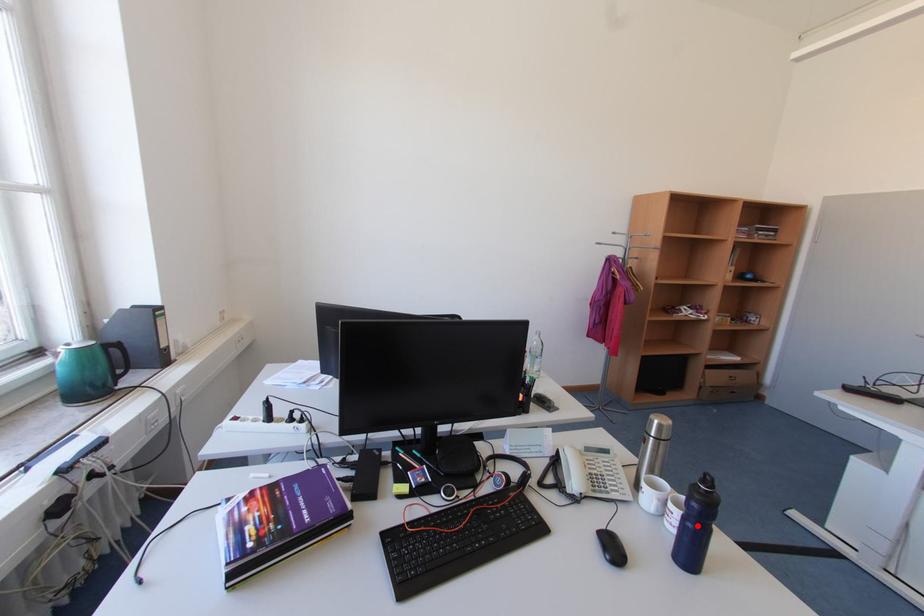
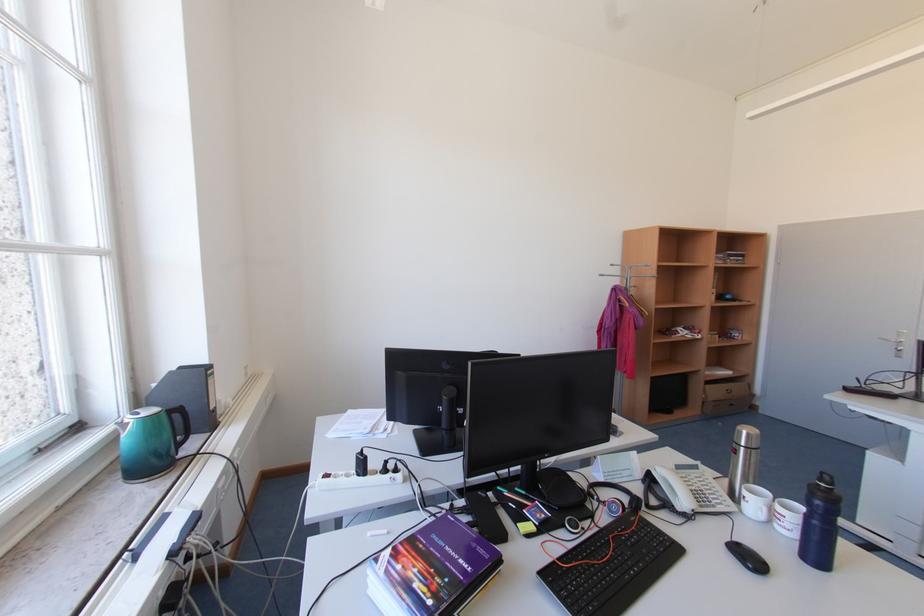
The point at the highlighted location is marked in the first image. Where is the corresponding point in the second image?

(824, 524)